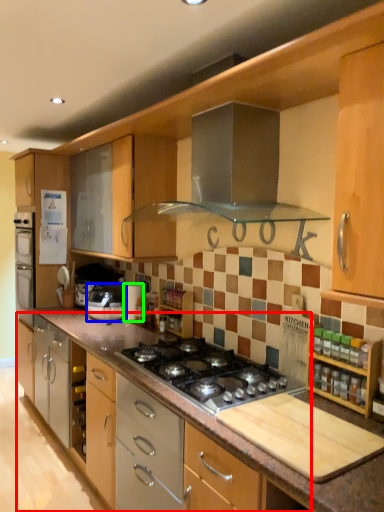
Question: Estimate the real-world distances between objects in this image. Which object is closer to cabinetry (highlighted by a red box), home appliance (highlighted by a blue box) or appliance (highlighted by a green box)?

Choices:
 (A) home appliance
 (B) appliance

Answer: (A)